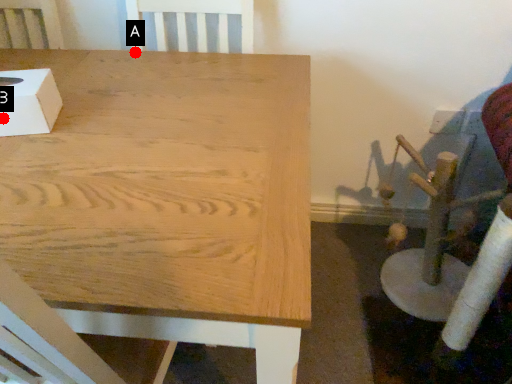
Question: Two points are circled on the image, labeled by A and B beside each circle. Which point is farther to the camera?

Choices:
 (A) A is further
 (B) B is further

Answer: (A)